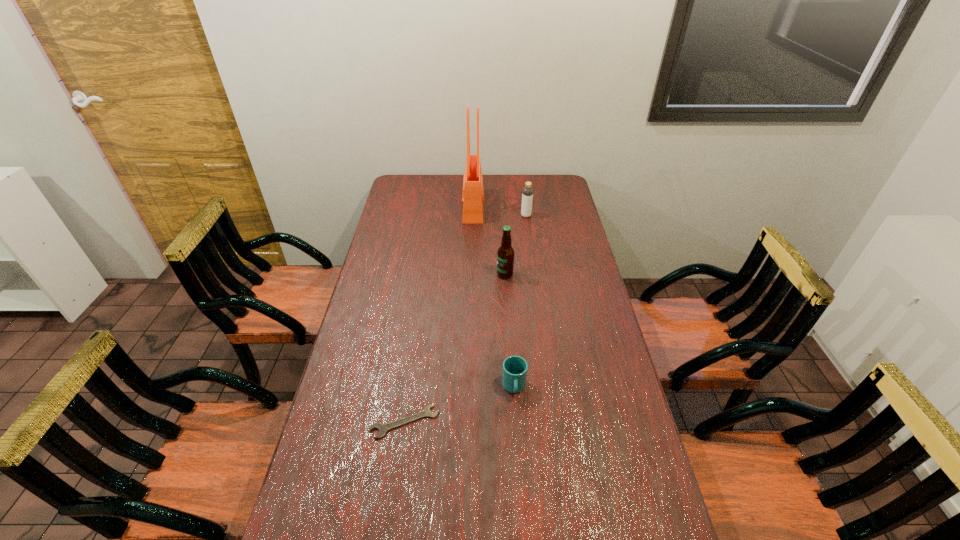
Locate an element on the screen. The height and width of the screenshot is (540, 960). free spot located on the logo side of the second object from left to right is located at coordinates (530, 207).

Where is `vacant space located on the label of the third farthest object`? The width and height of the screenshot is (960, 540). vacant space located on the label of the third farthest object is located at coordinates (481, 274).

The image size is (960, 540). Identify the location of vacant area located 0.230m on the label of the third farthest object. (438, 274).

At what (x,y) coordinates should I click in order to perform the action: click on vacant space located on the label of the third farthest object. Please return your answer as a coordinate pair (x, y). Image resolution: width=960 pixels, height=540 pixels. Looking at the image, I should click on (408, 274).

Find the location of a particular element. Image resolution: width=960 pixels, height=540 pixels. free space located on the front of the rightmost object is located at coordinates (527, 226).

Locate an element on the screen. The width and height of the screenshot is (960, 540). vacant space positioned on the handle side of the fourth tallest object is located at coordinates (516, 429).

Identify the location of free spot located on the right of the wrench. (460, 422).

Where is `object at the far edge`? object at the far edge is located at coordinates tap(473, 192).

This screenshot has width=960, height=540. I want to click on object at the left edge, so click(x=382, y=428).

In the image, there is a desktop. Where is `free space at the far edge`? free space at the far edge is located at coordinates (460, 188).